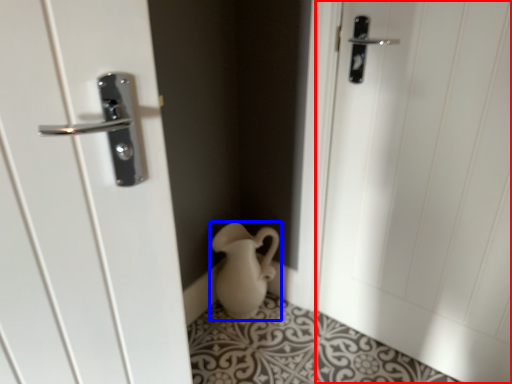
Question: Which of the following is the closest to the observer, door (highlighted by a red box) or jug (highlighted by a blue box)?

Choices:
 (A) door
 (B) jug

Answer: (A)